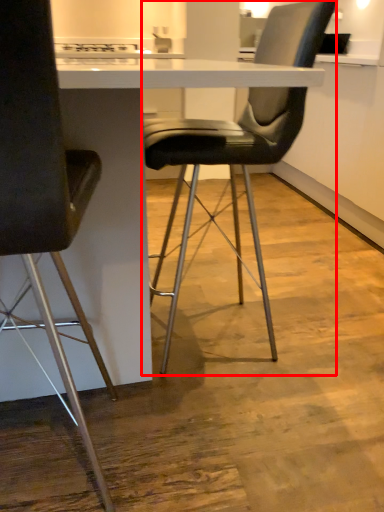
Question: Observing the image, what is the correct spatial positioning of chair (annotated by the red box) in reference to chair?

Choices:
 (A) left
 (B) right

Answer: (B)